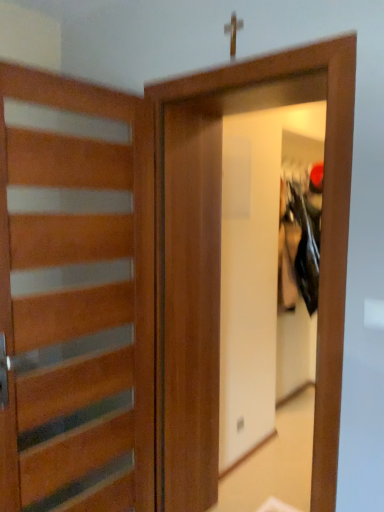
The width and height of the screenshot is (384, 512). What do you see at coordinates (76, 307) in the screenshot?
I see `wooden door at left` at bounding box center [76, 307].

You are a GUI agent. You are given a task and a screenshot of the screen. Output one action in this format:
    pyautogui.click(x=<x>, y=<y>)
    Task: Click on the wooden door at left
    This screenshot has width=384, height=512.
    Given the screenshot: What is the action you would take?
    pyautogui.click(x=76, y=307)

In order to click on wooden door at left in this screenshot , I will do `click(76, 307)`.